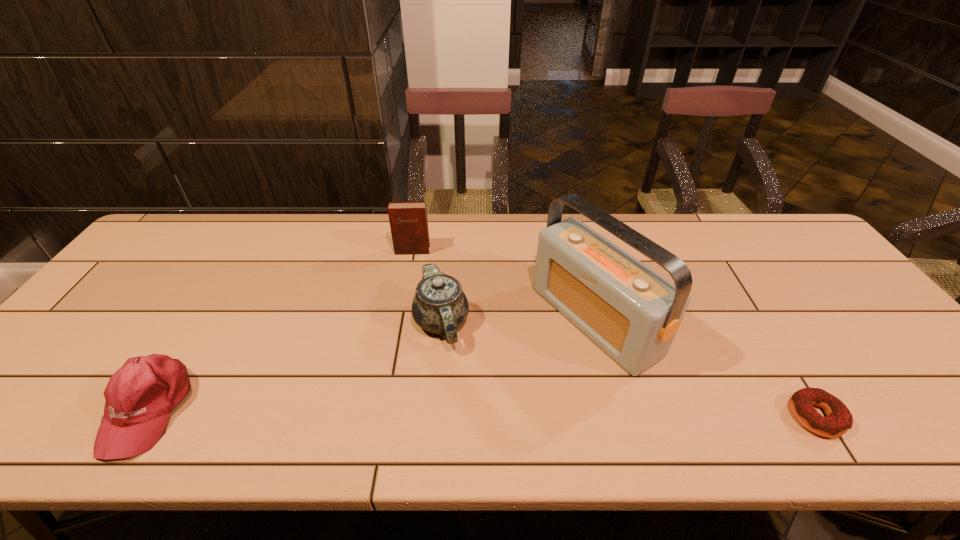
Where is `the second shortest object`? the second shortest object is located at coordinates (140, 396).

This screenshot has width=960, height=540. What are the coordinates of `baseball cap` in the screenshot? It's located at (140, 396).

Image resolution: width=960 pixels, height=540 pixels. Find the location of `the shortest object`. the shortest object is located at coordinates (839, 419).

Where is `doughnut`? The image size is (960, 540). doughnut is located at coordinates (839, 419).

At what (x,y) coordinates should I click in order to perform the action: click on diary. Please return your answer as a coordinate pair (x, y). This screenshot has width=960, height=540. Looking at the image, I should click on (408, 221).

You are a GUI agent. You are given a task and a screenshot of the screen. Output one action in this format:
    pyautogui.click(x=<x>, y=<y>)
    Task: Click on the tallest object
    The image size is (960, 540).
    Given the screenshot: What is the action you would take?
    pyautogui.click(x=633, y=313)

The width and height of the screenshot is (960, 540). Find the location of `radio receiver`. radio receiver is located at coordinates (633, 313).

At what (x,y) coordinates should I click in order to perform the action: click on the third tallest object. Please return your answer as a coordinate pair (x, y). This screenshot has height=540, width=960. Looking at the image, I should click on (439, 306).

This screenshot has width=960, height=540. Find the location of `vacant space located 0.060m on the back of the rightmost object`. vacant space located 0.060m on the back of the rightmost object is located at coordinates (787, 372).

Locate an element on the screen. vacant space located 0.270m on the front cover of the diary is located at coordinates (404, 320).